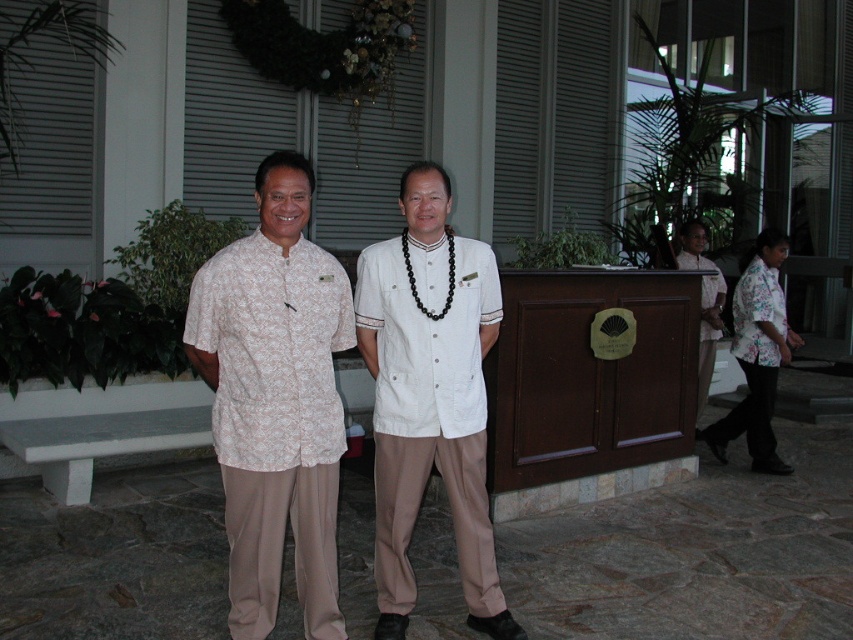
Does floral shirt at right have a larger size compared to white fabric blouse at right?

Correct, floral shirt at right is larger in size than white fabric blouse at right.

Describe the element at coordinates (757, 355) in the screenshot. The width and height of the screenshot is (853, 640). I see `floral shirt at right` at that location.

Where is `floral shirt at right`? Image resolution: width=853 pixels, height=640 pixels. floral shirt at right is located at coordinates (757, 355).

Who is shorter, white floral shirt at center or floral shirt at right?

floral shirt at right

Can you confirm if white floral shirt at center is smaller than floral shirt at right?

Yes.

Who is more forward, (343, 348) or (761, 428)?

Point (343, 348) is more forward.

Where is `white floral shirt at center`? white floral shirt at center is located at coordinates (276, 401).

Is white matte shirt at center to the left of floral shirt at right from the viewer's perspective?

Correct, you'll find white matte shirt at center to the left of floral shirt at right.

Between point (469, 596) and point (762, 401), which one is positioned in front?

Positioned in front is point (469, 596).

Is point (445, 401) in front of point (762, 388)?

Yes.

Where is `white matte shirt at center`? This screenshot has height=640, width=853. white matte shirt at center is located at coordinates (428, 396).